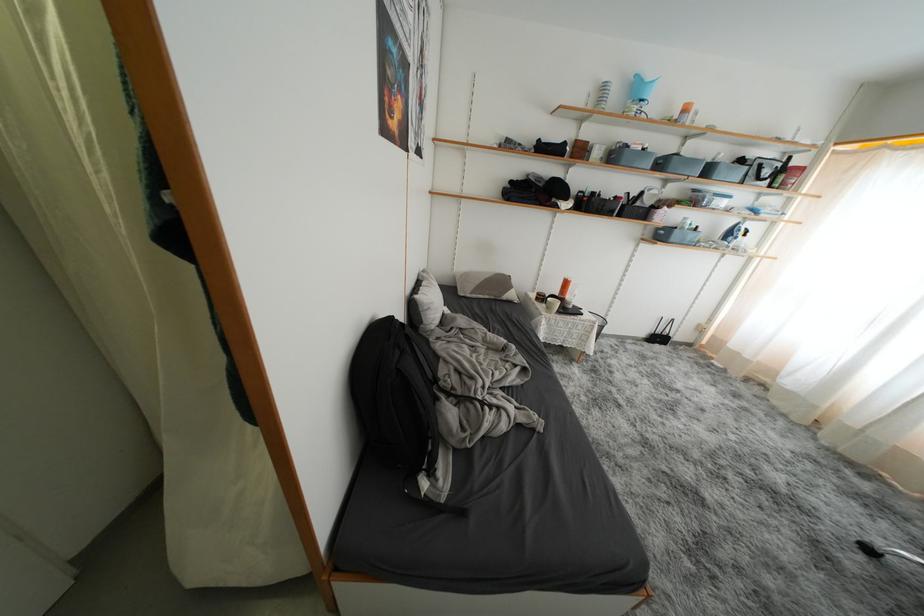
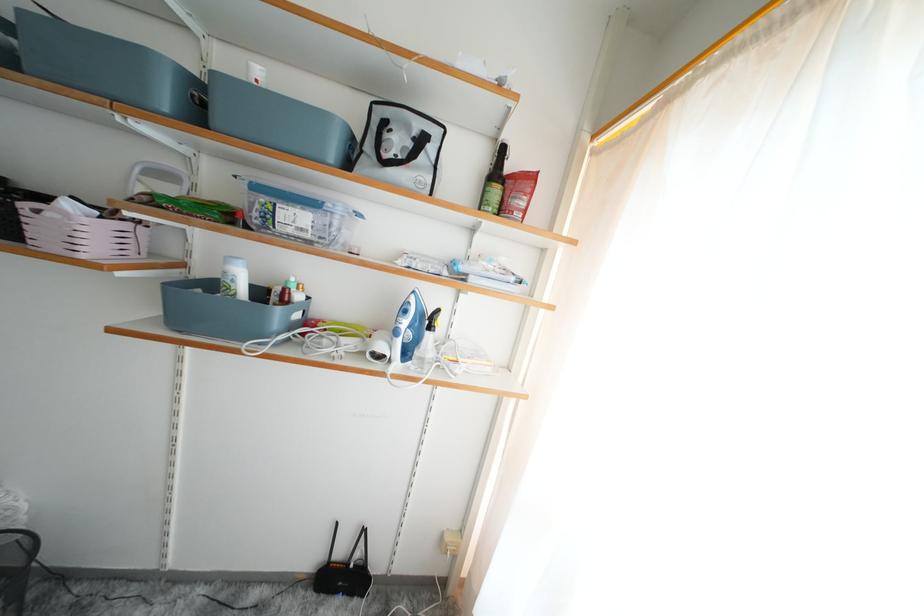
Looking at this image, which direction would the cameraman need to move to produce the second image?

The cameraman walked toward right, forward.